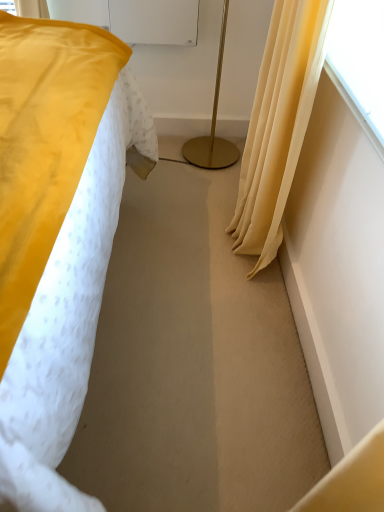
Find the location of a particular element. The image size is (384, 512). vacant space in front of matte yellow curtain at right is located at coordinates (227, 310).